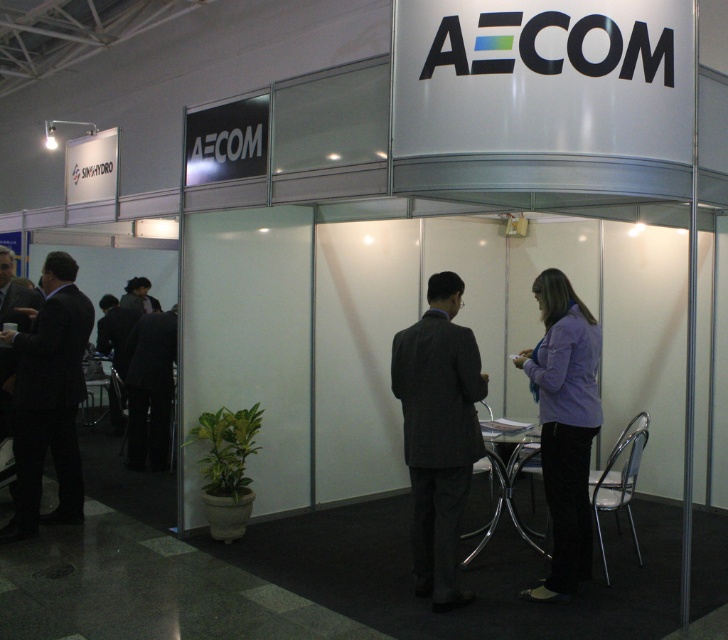
Can you confirm if dark gray suit at center is taller than black suit at left?

In fact, dark gray suit at center may be shorter than black suit at left.

Which is below, dark gray suit at center or black suit at left?

Positioned lower is dark gray suit at center.

Who is more forward, (455, 472) or (63, 509)?

Positioned in front is point (455, 472).

This screenshot has height=640, width=728. I want to click on dark gray suit at center, so click(x=438, y=433).

Is the position of black suit at left less distant than that of dark suit at left?

Yes, it is.

Is black suit at left taller than dark suit at left?

Yes, black suit at left is taller than dark suit at left.

I want to click on black suit at left, so click(47, 401).

Who is shorter, dark gray suit at center or dark suit at left?

With less height is dark suit at left.

Can you confirm if dark gray suit at center is positioned below dark suit at left?

Yes.

What do you see at coordinates (438, 433) in the screenshot? The image size is (728, 640). I see `dark gray suit at center` at bounding box center [438, 433].

Locate an element on the screen. The image size is (728, 640). dark gray suit at center is located at coordinates (438, 433).